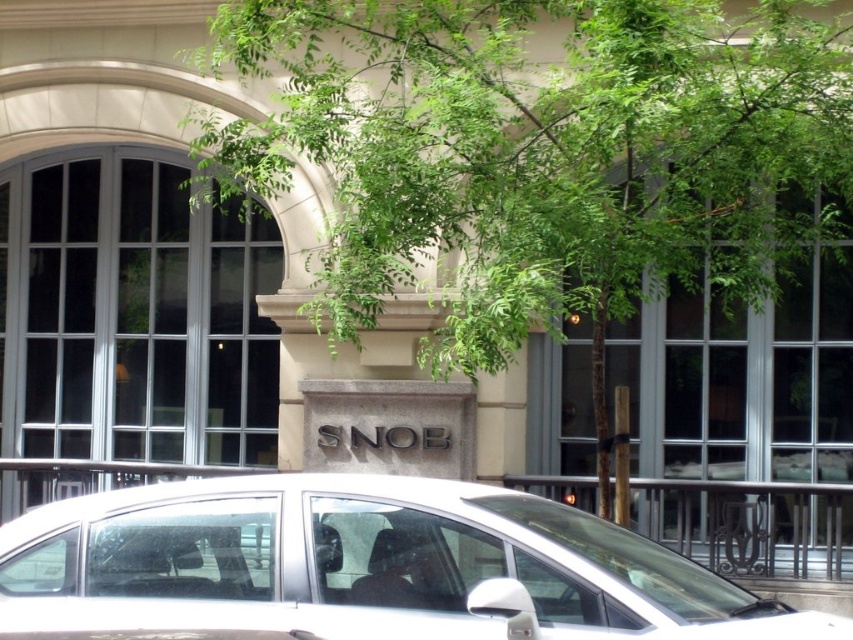
Can you confirm if green leafy tree at center is smaller than white matte car at center?

Incorrect, green leafy tree at center is not smaller in size than white matte car at center.

Which is above, green leafy tree at center or white matte car at center?

green leafy tree at center is above.

Describe the element at coordinates (543, 156) in the screenshot. I see `green leafy tree at center` at that location.

In order to click on green leafy tree at center in this screenshot , I will do `click(543, 156)`.